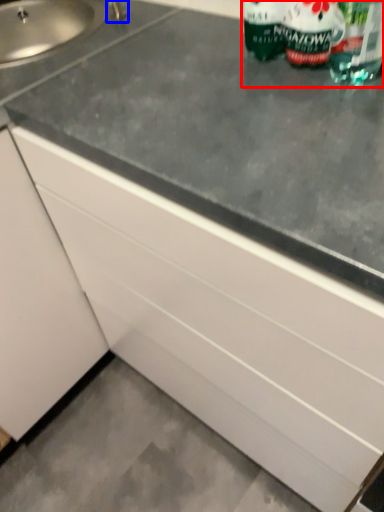
Question: Among these objects, which one is farthest to the camera, bottle (highlighted by a red box) or faucet (highlighted by a blue box)?

Choices:
 (A) bottle
 (B) faucet

Answer: (B)